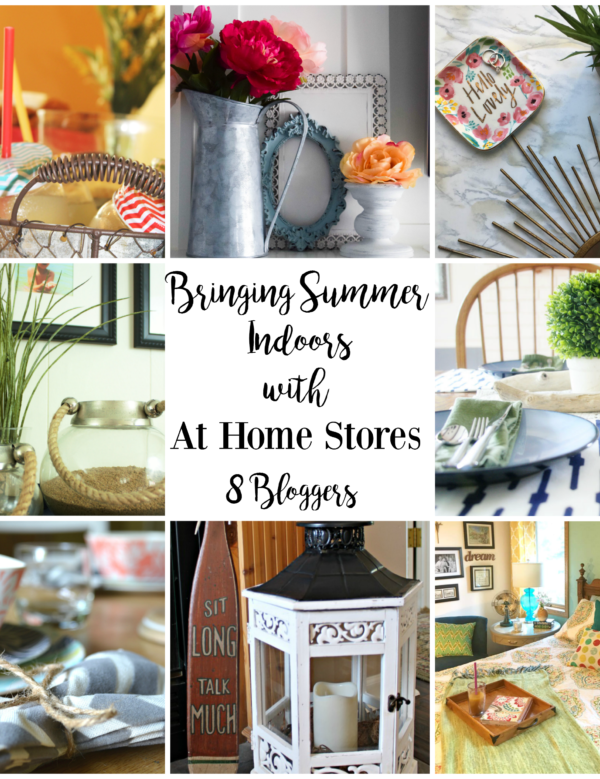
Where is `candle chapel`? The width and height of the screenshot is (600, 779). candle chapel is located at coordinates (392, 678).